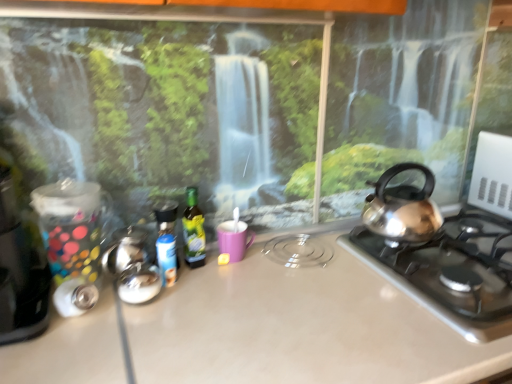
Where is `empty space that is in between matte purple mug at center and blue plastic bottle at center, arranged as the second bottle when viewed from the right`? The width and height of the screenshot is (512, 384). empty space that is in between matte purple mug at center and blue plastic bottle at center, arranged as the second bottle when viewed from the right is located at coordinates (206, 272).